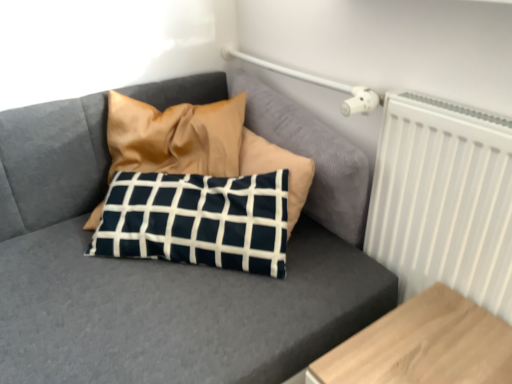
What is the approximate height of white matte radiator at upper right?

The height of white matte radiator at upper right is 24.16 inches.

Identify the location of navy blue fabric pillow at center. (170, 264).

Which is more to the left, navy blue fabric pillow at center or light brown wood table at lower right?

navy blue fabric pillow at center.

How many degrees apart are the facing directions of navy blue fabric pillow at center and light brown wood table at lower right?

41.7 degrees.

From the image's perspective, which is below, navy blue fabric pillow at center or light brown wood table at lower right?

light brown wood table at lower right appears lower in the image.

Can you confirm if navy blue fabric pillow at center is wider than light brown wood table at lower right?

Incorrect, the width of navy blue fabric pillow at center does not surpass that of light brown wood table at lower right.

Can you confirm if white matte radiator at upper right is thinner than navy blue fabric pillow at center?

Yes, white matte radiator at upper right is thinner than navy blue fabric pillow at center.

Is point (396, 97) farther from viewer compared to point (25, 238)?

No, (396, 97) is closer to viewer.

Is white matte radiator at upper right facing towards navy blue fabric pillow at center?

No, white matte radiator at upper right is not aimed at navy blue fabric pillow at center.

From the image's perspective, which is above, white matte radiator at upper right or navy blue fabric pillow at center?

navy blue fabric pillow at center is shown above in the image.

Do you think light brown wood table at lower right is within navy blue fabric pillow at center, or outside of it?

light brown wood table at lower right is outside navy blue fabric pillow at center.

Measure the distance from light brown wood table at lower right to navy blue fabric pillow at center.

They are 15.41 inches apart.

Based on their sizes in the image, would you say light brown wood table at lower right is bigger or smaller than navy blue fabric pillow at center?

Considering their sizes, light brown wood table at lower right takes up less space than navy blue fabric pillow at center.

In terms of height, does navy blue fabric pillow at center look taller or shorter compared to white matte radiator at upper right?

Considering their sizes, navy blue fabric pillow at center has less height than white matte radiator at upper right.

Where is `radiator above the navy blue fabric pillow at center (from a real-world perspective)`? Image resolution: width=512 pixels, height=384 pixels. radiator above the navy blue fabric pillow at center (from a real-world perspective) is located at coordinates (444, 199).

Is navy blue fabric pillow at center with white matte radiator at upper right?

No.

Which point is more distant from viewer, (x=264, y=335) or (x=444, y=240)?

The point (x=444, y=240) is more distant.

The height and width of the screenshot is (384, 512). Identify the location of furniture on the left of white matte radiator at upper right. (423, 345).

From the picture: From the image's perspective, which is below, light brown wood table at lower right or white matte radiator at upper right?

light brown wood table at lower right is shown below in the image.

Considering the points (505, 335) and (508, 136), which point is in front, point (505, 335) or point (508, 136)?

Positioned in front is point (508, 136).

Is white matte radiator at upper right beside light brown wood table at lower right?

white matte radiator at upper right and light brown wood table at lower right are not in contact.

Is light brown wood table at lower right a part of white matte radiator at upper right?

Actually, light brown wood table at lower right is outside white matte radiator at upper right.

How many degrees apart are the facing directions of white matte radiator at upper right and light brown wood table at lower right?

The angular difference between white matte radiator at upper right and light brown wood table at lower right is 0.00172 degrees.

Between point (504, 182) and point (446, 346), which one is positioned in front?

The point (504, 182) is in front.

Image resolution: width=512 pixels, height=384 pixels. I want to click on studio couch above the light brown wood table at lower right (from a real-world perspective), so click(170, 264).

Where is `studio couch to the left of white matte radiator at upper right`? The image size is (512, 384). studio couch to the left of white matte radiator at upper right is located at coordinates (170, 264).

In the scene shown: Looking at the image, which one is located closer to white matte radiator at upper right, navy blue fabric pillow at center or light brown wood table at lower right?

light brown wood table at lower right is positioned closer to the anchor white matte radiator at upper right.

Considering their positions, is navy blue fabric pillow at center positioned closer to light brown wood table at lower right than white matte radiator at upper right?

white matte radiator at upper right lies closer to light brown wood table at lower right than the other object.

In the scene shown: From the image, which object appears to be farther from white matte radiator at upper right, light brown wood table at lower right or navy blue fabric pillow at center?

navy blue fabric pillow at center is positioned further to the anchor white matte radiator at upper right.

Based on their spatial positions, is light brown wood table at lower right or white matte radiator at upper right further from navy blue fabric pillow at center?

The object further to navy blue fabric pillow at center is light brown wood table at lower right.

Based on their spatial positions, is white matte radiator at upper right or light brown wood table at lower right closer to navy blue fabric pillow at center?

The object closer to navy blue fabric pillow at center is white matte radiator at upper right.

Looking at the image, which one is located further to light brown wood table at lower right, white matte radiator at upper right or navy blue fabric pillow at center?

Among the two, navy blue fabric pillow at center is located further to light brown wood table at lower right.

Locate an element on the screen. furniture situated between navy blue fabric pillow at center and white matte radiator at upper right from left to right is located at coordinates (423, 345).